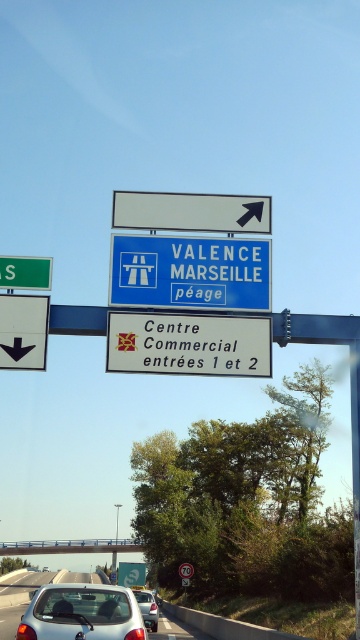
You are a driver approaching the highway and see the white glossy car at lower center. According to the road signs, where is the toll booth located relative to the car?

The toll booth is located above the white glossy car at lower center, as indicated by the blue sign with white text and toll booth graphic positioned above it.

You are a driver approaching the highway and see the silver metallic car at center ahead. Based on its position, which direction should you turn to avoid it?

The silver metallic car at center is located at point coordinates (146,608), so you should turn to the left to avoid it.